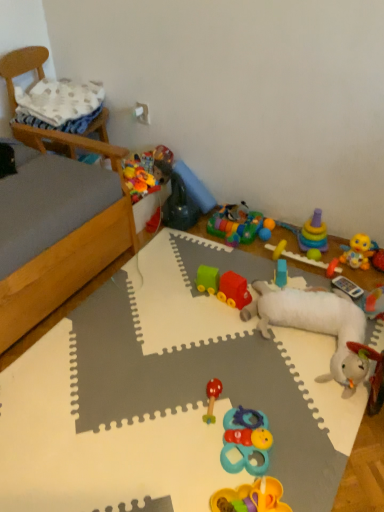
The width and height of the screenshot is (384, 512). Find the location of `free space between rubberized red mushroom at center, which is counted as the ninth toy, starting from the top, and blue plastic toy at center, which is counted as the sixth toy, starting from the top`. free space between rubberized red mushroom at center, which is counted as the ninth toy, starting from the top, and blue plastic toy at center, which is counted as the sixth toy, starting from the top is located at coordinates (243, 350).